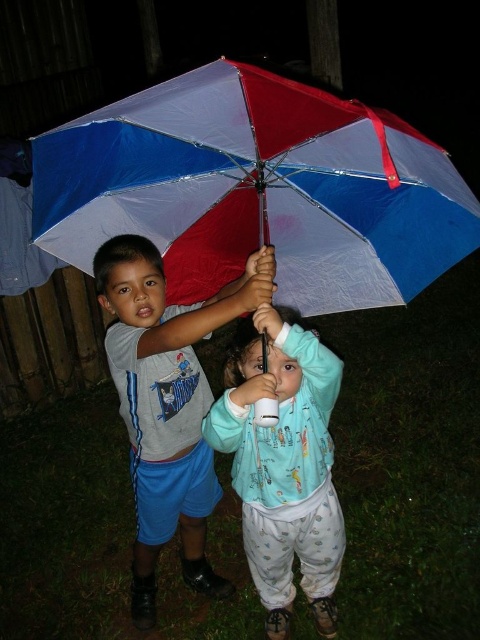
Does red and white plastic umbrella at center have a greater width compared to gray cotton shirt at center?

Indeed, red and white plastic umbrella at center has a greater width compared to gray cotton shirt at center.

Does red and white plastic umbrella at center appear on the left side of gray cotton shirt at center?

Incorrect, red and white plastic umbrella at center is not on the left side of gray cotton shirt at center.

Between point (36, 221) and point (179, 387), which one is positioned behind?

Point (179, 387)

Where is `red and white plastic umbrella at center`? red and white plastic umbrella at center is located at coordinates (256, 189).

Does gray cotton shirt at center lie in front of light blue fleece jacket at center?

Yes, gray cotton shirt at center is in front of light blue fleece jacket at center.

Is gray cotton shirt at center shorter than light blue fleece jacket at center?

In fact, gray cotton shirt at center may be taller than light blue fleece jacket at center.

Locate an element on the screen. The height and width of the screenshot is (640, 480). gray cotton shirt at center is located at coordinates [168, 403].

Does point (98, 150) come in front of point (235, 358)?

Yes, point (98, 150) is in front of point (235, 358).

Which is above, red and white plastic umbrella at center or light blue fleece jacket at center?

red and white plastic umbrella at center

The width and height of the screenshot is (480, 640). Identify the location of red and white plastic umbrella at center. (256, 189).

The width and height of the screenshot is (480, 640). What are the coordinates of `red and white plastic umbrella at center` in the screenshot? It's located at (256, 189).